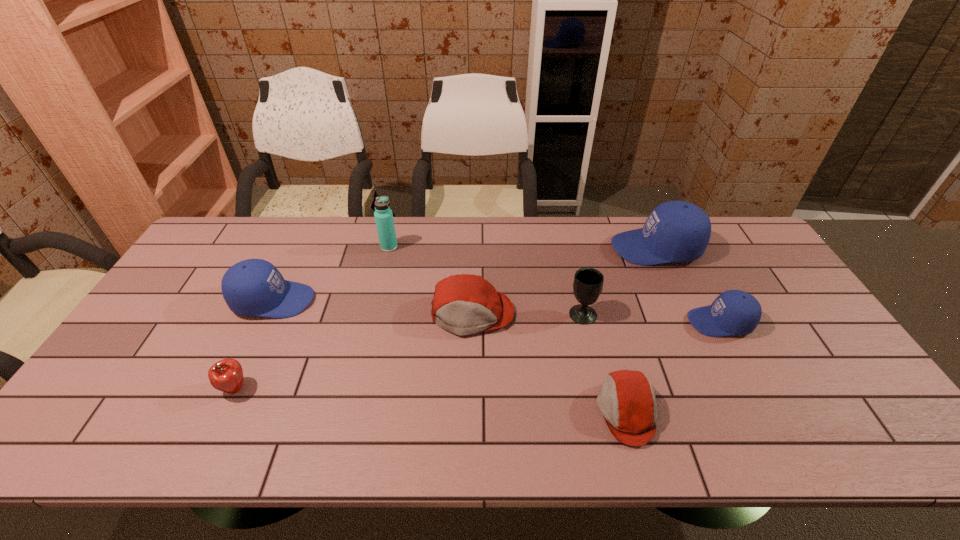
Identify the location of thermos bottle. (383, 214).

Identify the location of aqua thermos bottle. (383, 214).

Where is `the farthest cap`? Image resolution: width=960 pixels, height=540 pixels. the farthest cap is located at coordinates (675, 231).

What are the coordinates of `the farthest blue cap` in the screenshot? It's located at (675, 231).

Where is `chalice`? This screenshot has width=960, height=540. chalice is located at coordinates (588, 283).

Locate an element on the screen. This screenshot has height=540, width=960. the leftmost blue cap is located at coordinates (254, 287).

The image size is (960, 540). Find the location of `the second smallest blue cap`. the second smallest blue cap is located at coordinates (254, 287).

Identify the location of the fifth object from right to left. The image size is (960, 540). (464, 304).

Locate an element on the screen. the left red cap is located at coordinates (464, 304).

Locate an element on the screen. The width and height of the screenshot is (960, 540). the smallest blue cap is located at coordinates (734, 312).